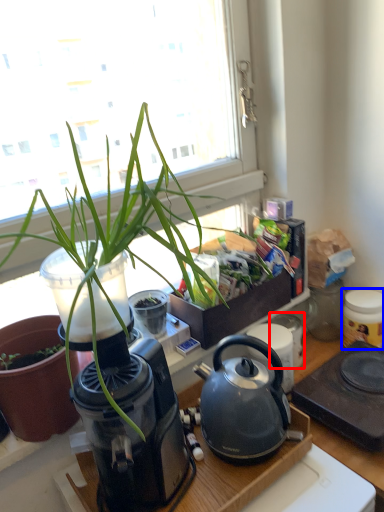
Question: Which object appears farthest to the camera in this image, appliance (highlighted by a red box) or appliance (highlighted by a blue box)?

Choices:
 (A) appliance
 (B) appliance

Answer: (A)